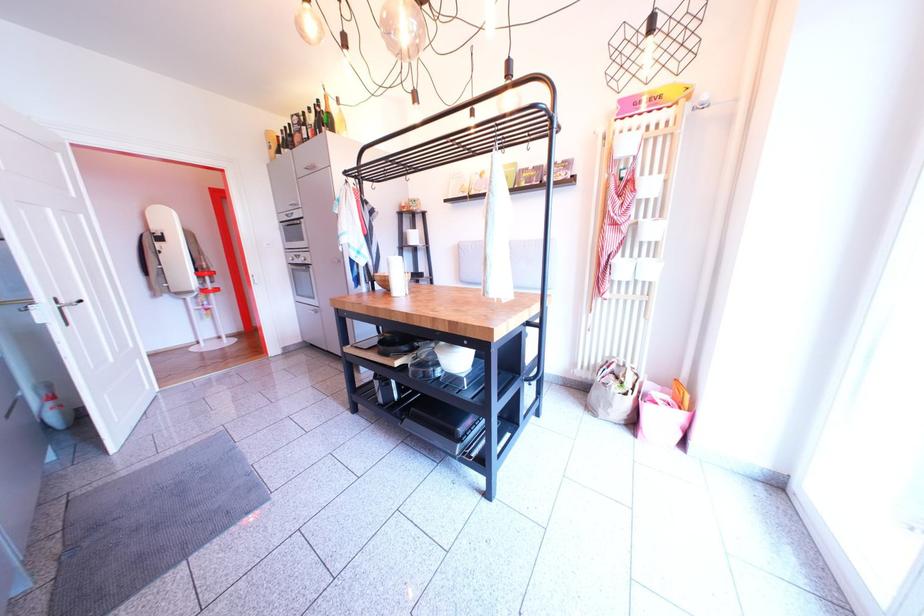
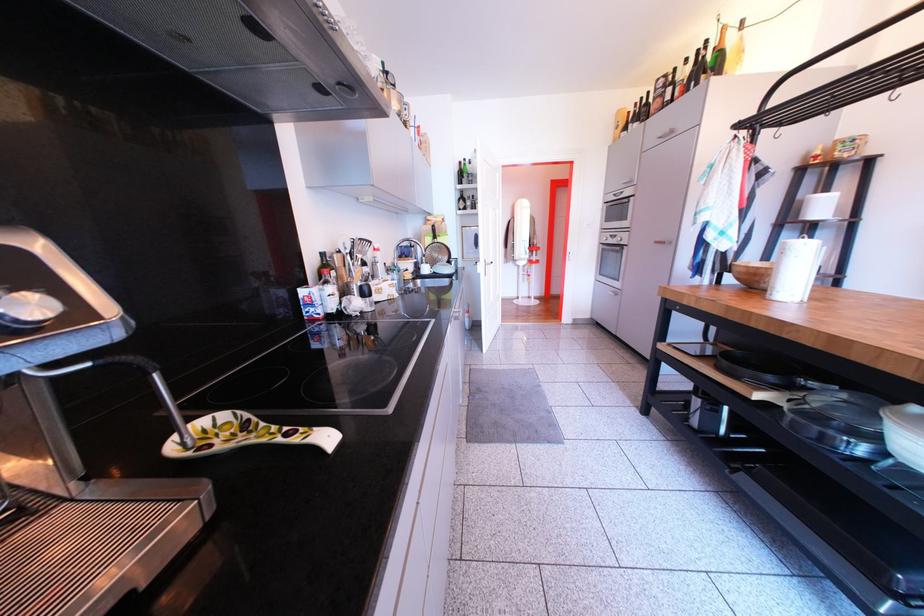
Where in the second image is the point corresponding to the point at 55,321 from the first image?

(492, 274)